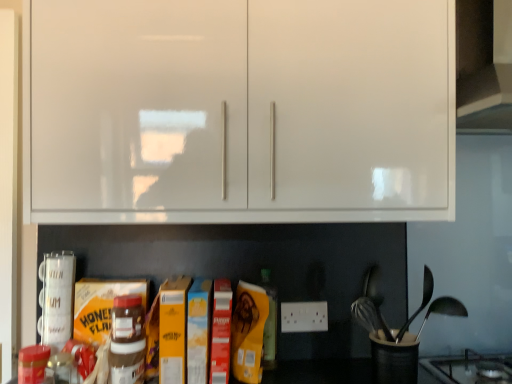
Question: Is matte brown plastic nutella jar at center, marked as the second bottle in a back-to-front arrangement, in front of or behind white glossy cabinet at upper center in the image?

Choices:
 (A) behind
 (B) front

Answer: (A)

Question: Is matte brown plastic nutella jar at center, acting as the 1th bottle starting from the left, inside the boundaries of white glossy cabinet at upper center, or outside?

Choices:
 (A) inside
 (B) outside

Answer: (B)

Question: Based on their relative distances, which object is farther from the black plastic utensil holder at lower right?

Choices:
 (A) matte brown plastic nutella jar at center, acting as the 1th bottle starting from the left
 (B) white glossy cabinet at upper center
 (C) black glass gas stove at lower right
 (D) matte brown bottle at center, which ranks as the second bottle in front-to-back order
 (E) satin silver spoon at right

Answer: (B)

Question: Which of these objects is positioned closest to the black glass gas stove at lower right?

Choices:
 (A) black plastic utensil holder at lower right
 (B) satin silver spoon at right
 (C) white glossy cabinet at upper center
 (D) matte brown plastic nutella jar at center, the second bottle positioned from the right
 (E) matte brown bottle at center, which ranks as the second bottle in front-to-back order

Answer: (A)